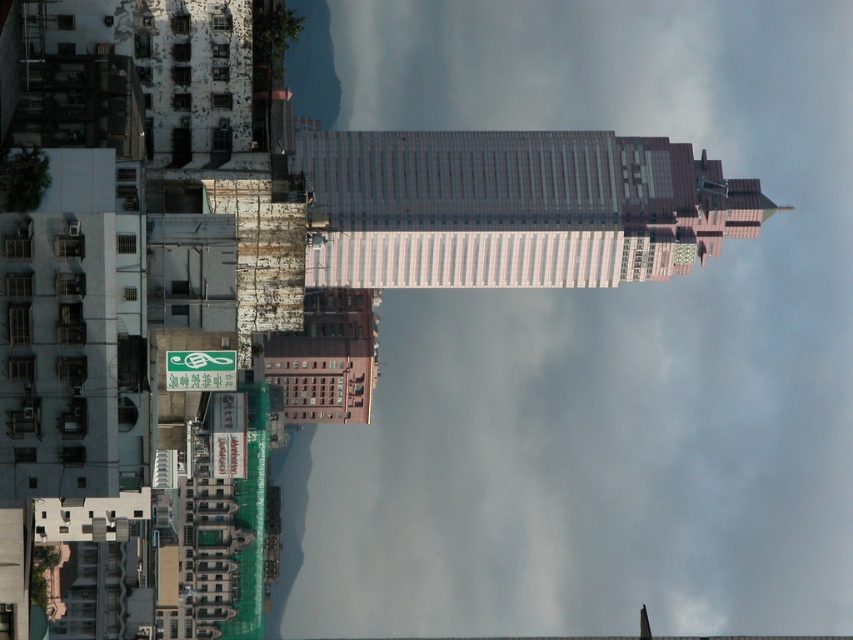
Question: Which of the following is the closest to the observer?

Choices:
 (A) (490, 16)
 (B) (432, 148)

Answer: (B)

Question: Is transparent glass skyscraper at center to the right of light gray glass skyscraper at center from the viewer's perspective?

Choices:
 (A) no
 (B) yes

Answer: (B)

Question: Is transparent glass skyscraper at center to the left of light gray glass skyscraper at center from the viewer's perspective?

Choices:
 (A) yes
 (B) no

Answer: (B)

Question: Where is transparent glass skyscraper at center located in relation to light gray glass skyscraper at center in the image?

Choices:
 (A) left
 (B) right

Answer: (B)